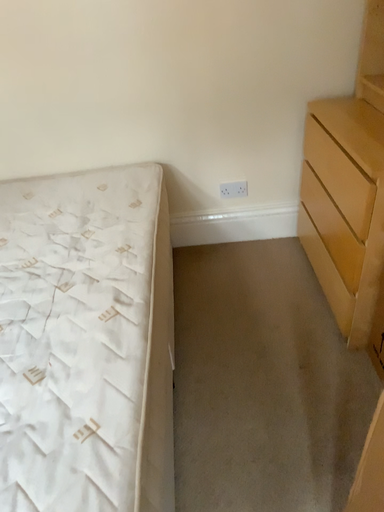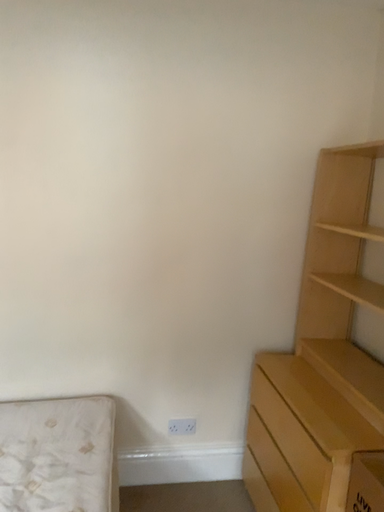
Question: How did the camera likely rotate when shooting the video?

Choices:
 (A) rotated upward
 (B) rotated downward

Answer: (A)